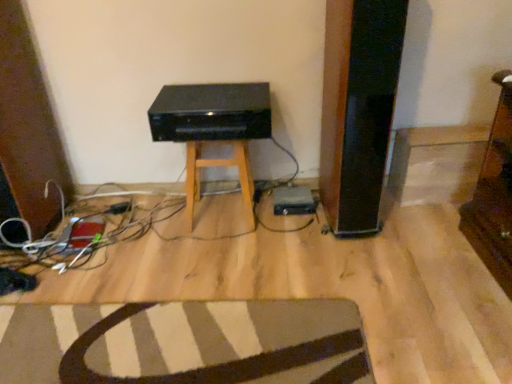
Locate an element on the screen. The height and width of the screenshot is (384, 512). vacant space situated on the left part of black plastic plug at lower left is located at coordinates (88, 210).